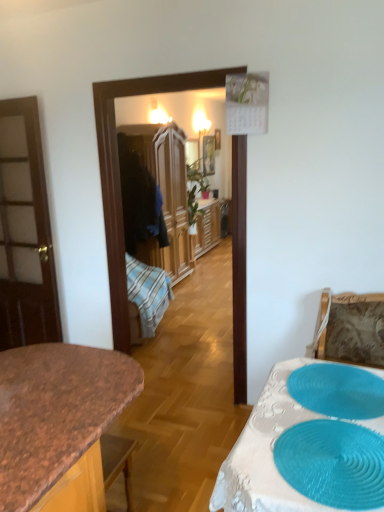
This screenshot has height=512, width=384. Identify the location of free point above granite countertop at center (from a real-world perspective). (53, 391).